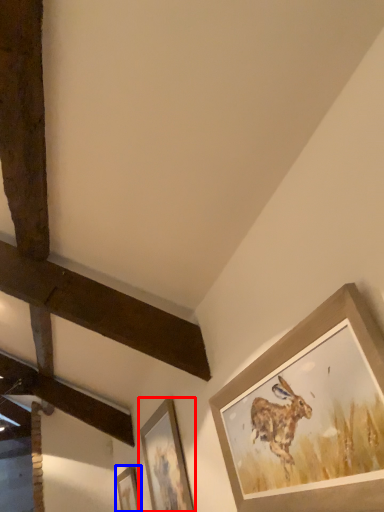
Question: Which object appears farthest to the camera in this image, picture frame (highlighted by a red box) or picture frame (highlighted by a blue box)?

Choices:
 (A) picture frame
 (B) picture frame

Answer: (B)